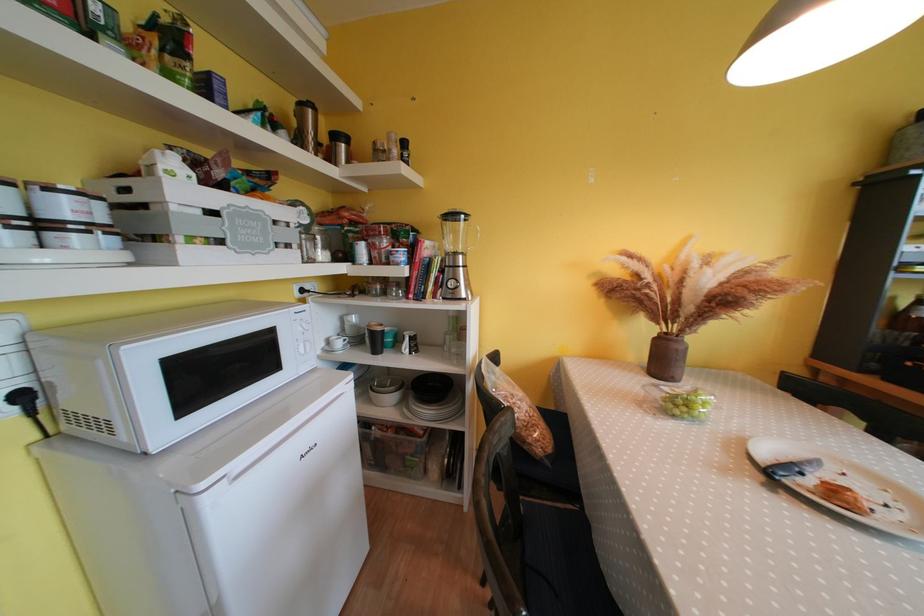
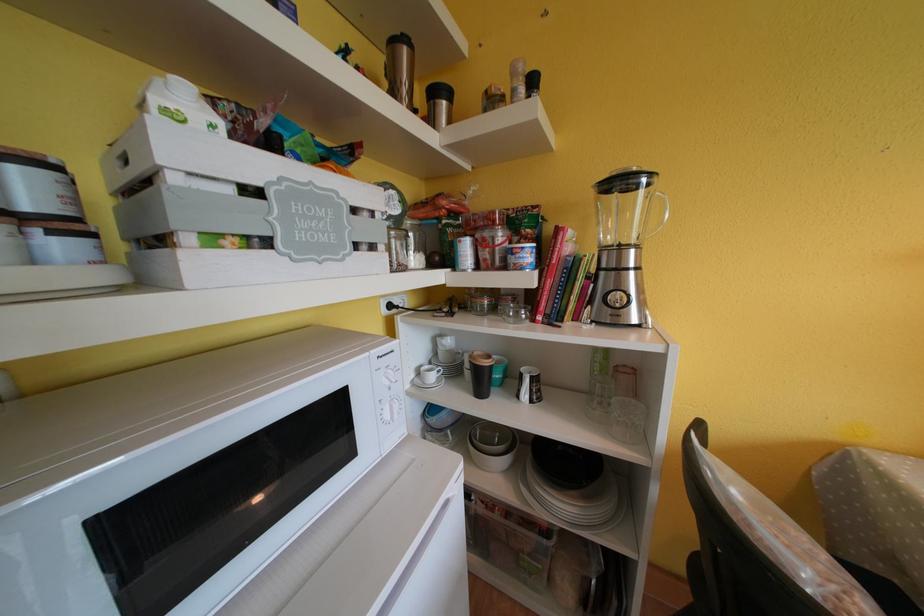
The images are taken continuously from a first-person perspective. In which direction are you moving?

The cameraman walked toward left, forward.